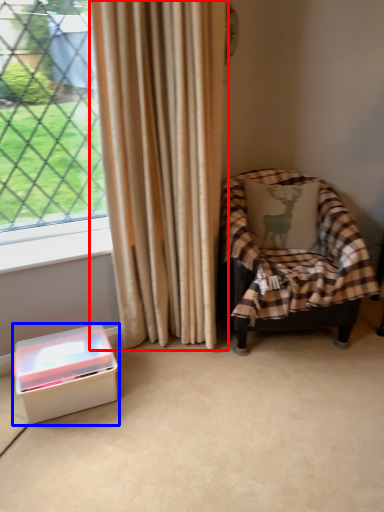
Question: Which object appears farthest to the camera in this image, curtain (highlighted by a red box) or box (highlighted by a blue box)?

Choices:
 (A) curtain
 (B) box

Answer: (B)